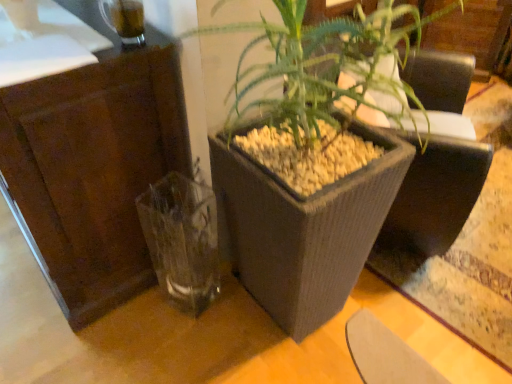
This screenshot has height=384, width=512. What are the coordinates of `free space in front of transparent glass vase at lower left` in the screenshot? It's located at (177, 352).